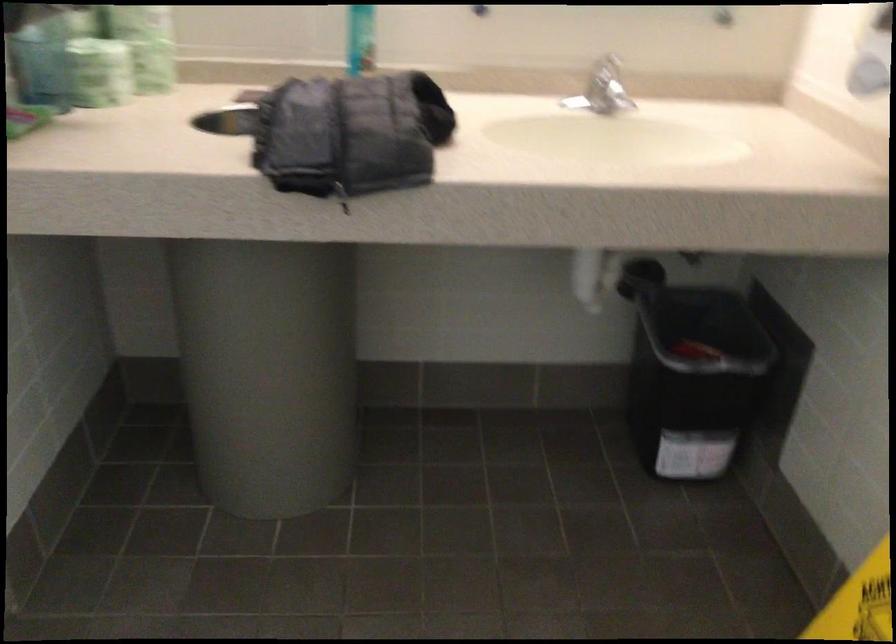
What do you see at coordinates (607, 87) in the screenshot?
I see `the faucet handle` at bounding box center [607, 87].